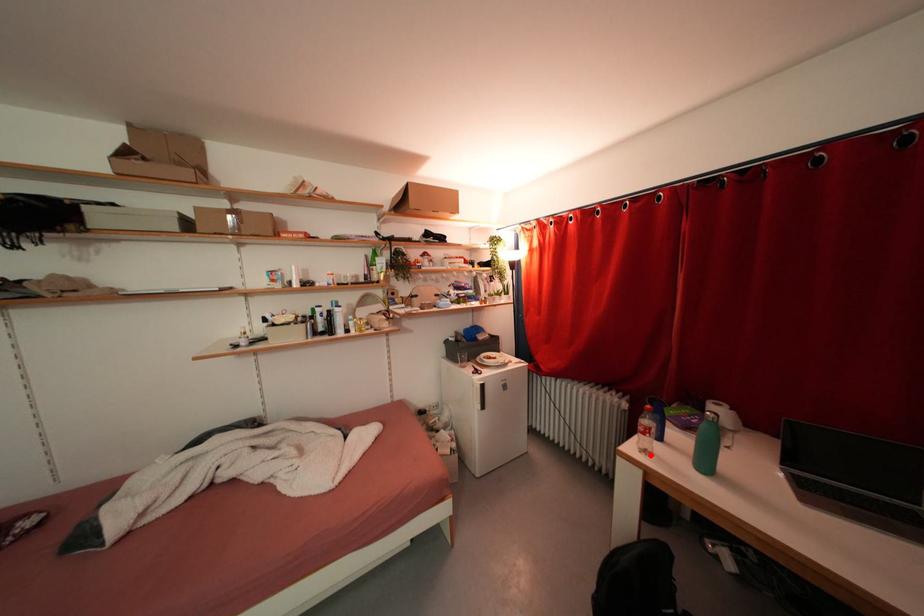
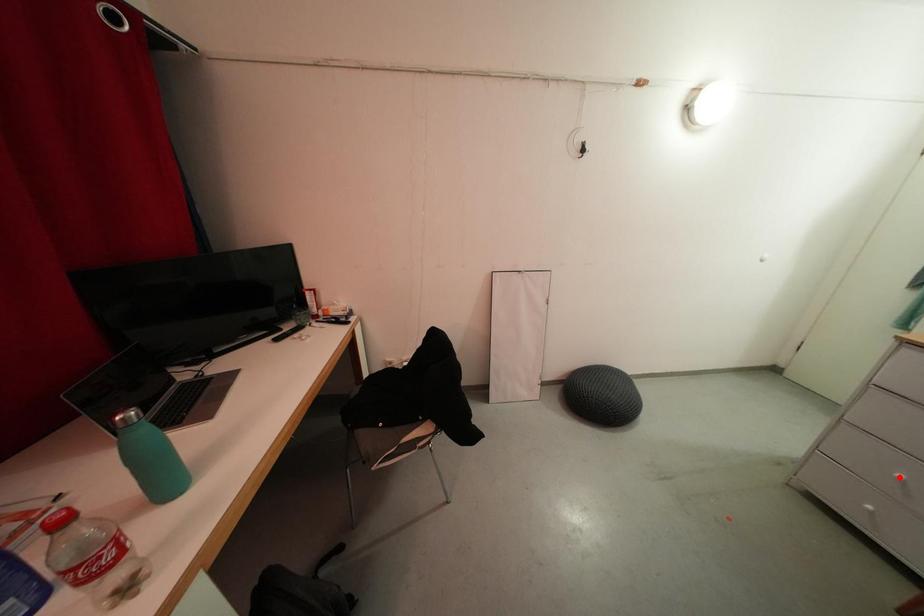
I am providing you with two images of the same scene from different viewpoints. A red point is marked on the first image and another point is marked on the second image. Do the highlighted points in image1 and image2 indicate the same real-world spot?

No